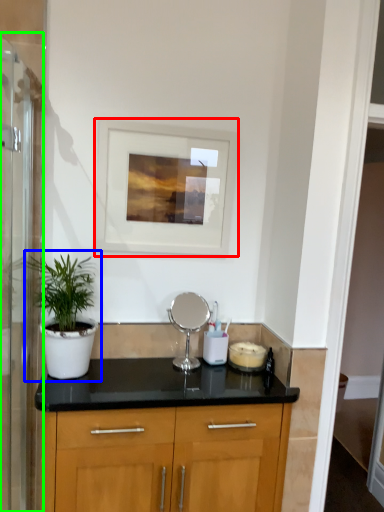
Question: Which is nearer to the picture frame (highlighted by a red box)? houseplant (highlighted by a blue box) or screen door (highlighted by a green box).

Choices:
 (A) houseplant
 (B) screen door

Answer: (A)